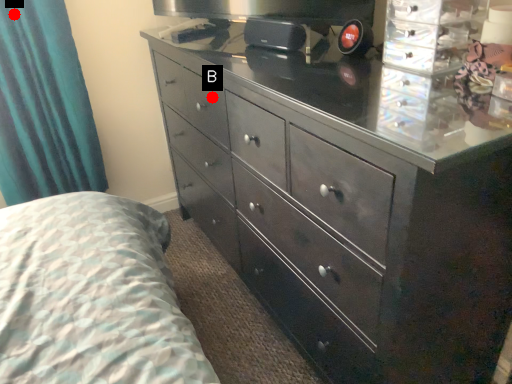
Question: Two points are circled on the image, labeled by A and B beside each circle. Which point is closer to the camera?

Choices:
 (A) A is closer
 (B) B is closer

Answer: (B)